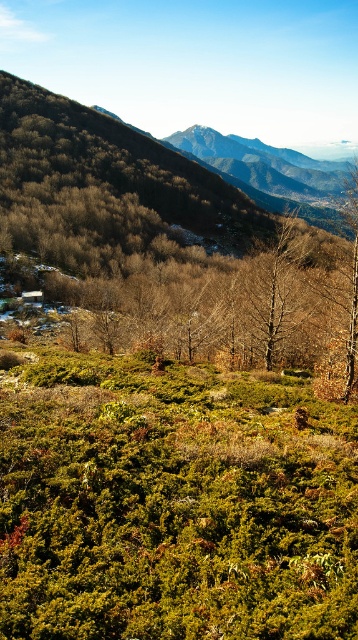
Question: Which point is farther to the camera?

Choices:
 (A) brown matte tree at upper right
 (B) bare wood tree at center

Answer: (B)

Question: In this image, where is bare wood tree at center located relative to brown matte tree at upper right?

Choices:
 (A) left
 (B) right

Answer: (A)

Question: Is bare wood tree at center to the left of brown matte tree at upper right from the viewer's perspective?

Choices:
 (A) no
 (B) yes

Answer: (B)

Question: Which object is farther from the camera taking this photo?

Choices:
 (A) brown matte tree at upper right
 (B) bare wood tree at center

Answer: (B)

Question: Is bare wood tree at center closer to the viewer compared to brown matte tree at upper right?

Choices:
 (A) yes
 (B) no

Answer: (B)